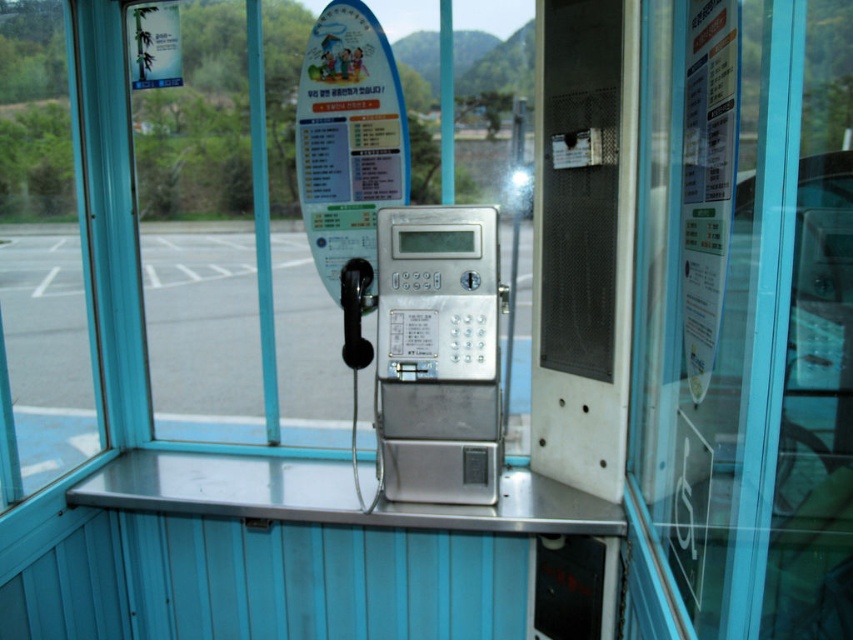
From the picture: You are standing inside the payphone booth and want to check the parking lot outside. Which object, the gray asphalt parking lot at center or the sleek silver phone at center, is closer to you?

The sleek silver phone at center is closer to you than the gray asphalt parking lot at center because the gray asphalt parking lot at center is further to the viewer.

You are standing inside the payphone booth and looking out through the glass. There is a point marked at coordinates (238, 324). What does this point indicate?

The point at coordinates (238, 324) marks the gray asphalt parking lot at center.

You are standing inside the payphone booth and looking out through the glass. You notice the gray asphalt parking lot at center and the sleek silver phone at center. Which object appears taller from your viewpoint?

The sleek silver phone at center appears taller than the gray asphalt parking lot at center because the description states that the parking lot is not as tall as the phone.